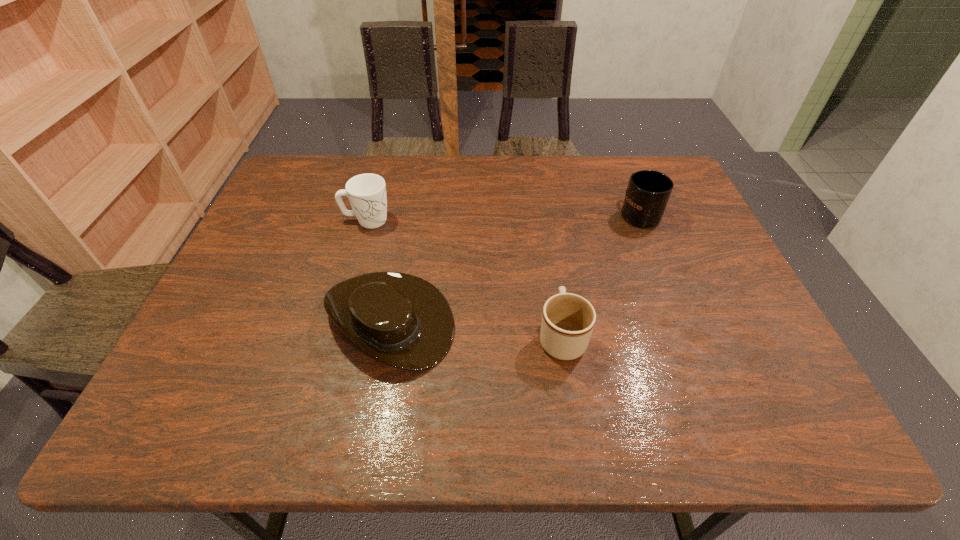
The width and height of the screenshot is (960, 540). What are the coordinates of `free space that satisfies the following two spatial constraints: 1. on the side of the cowboy hat with the handle; 2. on the left side of the leftmost mug` in the screenshot? It's located at (338, 320).

The width and height of the screenshot is (960, 540). What are the coordinates of `free space that satisfies the following two spatial constraints: 1. on the side of the cowboy hat with the handle; 2. on the right side of the leftmost mug` in the screenshot? It's located at (338, 320).

Locate an element on the screen. The image size is (960, 540). blank space that satisfies the following two spatial constraints: 1. on the side of the second mug from left to right with the handle; 2. on the side of the leftmost mug with the handle is located at coordinates (543, 220).